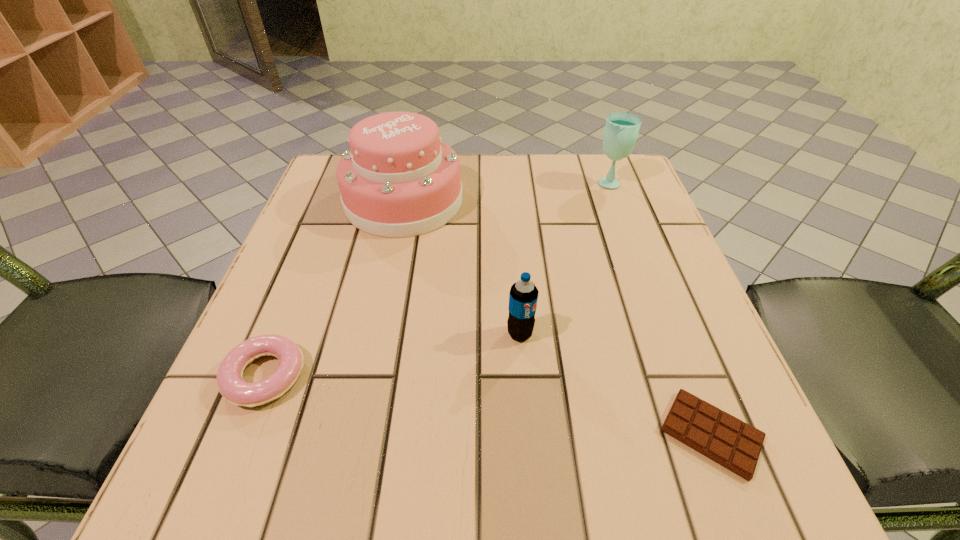
At what (x,y) coordinates should I click in order to perform the action: click on object at the near right corner. Please return your answer as a coordinate pair (x, y). Looking at the image, I should click on (730, 442).

At what (x,y) coordinates should I click in order to perform the action: click on vacant space at the far edge of the desktop. Please return your answer as a coordinate pair (x, y). The height and width of the screenshot is (540, 960). Looking at the image, I should click on (487, 153).

In the image, there is a desktop. Where is `free space at the near edge`? free space at the near edge is located at coordinates (498, 457).

In the image, there is a desktop. Where is `blank space at the left edge`? blank space at the left edge is located at coordinates tap(341, 320).

This screenshot has height=540, width=960. I want to click on vacant space at the right edge, so click(683, 333).

Locate an element on the screen. Image resolution: width=960 pixels, height=540 pixels. free space at the near left corner is located at coordinates (215, 433).

Where is `vacant space at the near right corner of the desktop`? vacant space at the near right corner of the desktop is located at coordinates (662, 475).

The height and width of the screenshot is (540, 960). Find the location of `unoccupied position between the cake and the shortest object`. unoccupied position between the cake and the shortest object is located at coordinates (558, 318).

Locate an element on the screen. empty location between the soda bottle and the cake is located at coordinates (462, 267).

Find the location of a particular element. The height and width of the screenshot is (540, 960). empty space that is in between the third tallest object and the glass is located at coordinates (564, 258).